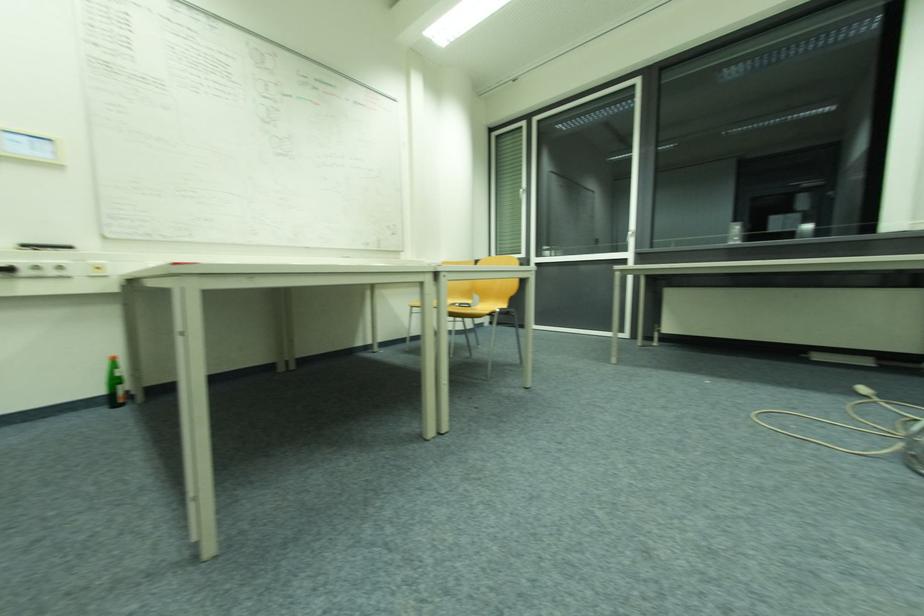
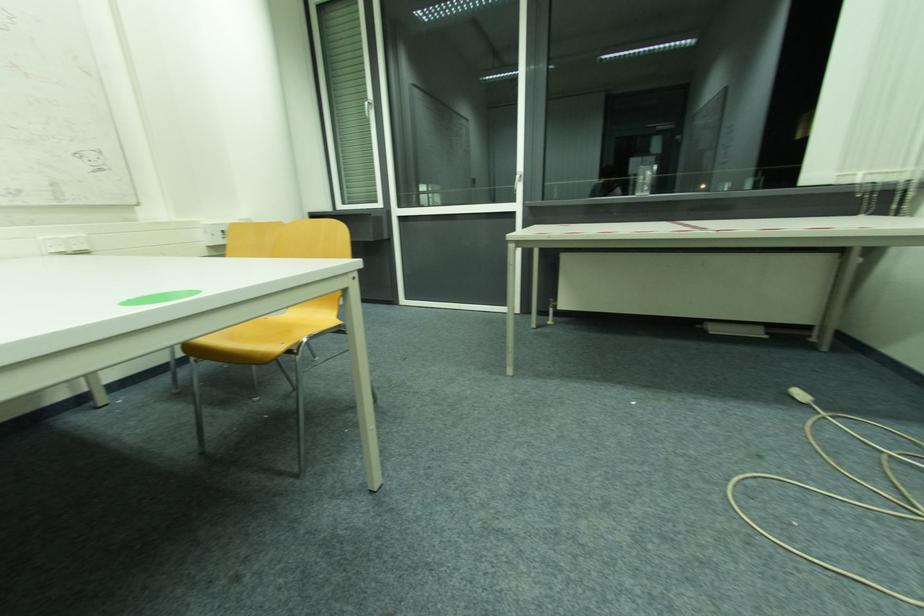
Which direction would the cameraman need to move to produce the second image?

The cameraman moved toward right, forward.